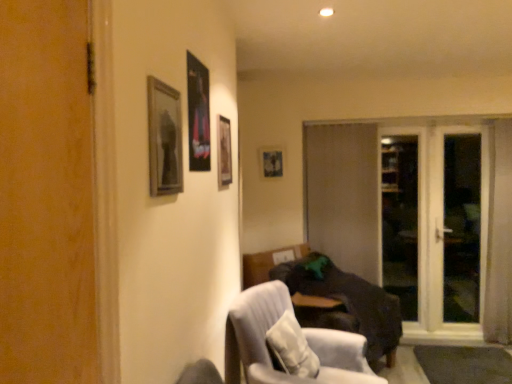
Question: From the image's perspective, is brown matte door at center located above dark brown fabric couch at lower right?

Choices:
 (A) no
 (B) yes

Answer: (B)

Question: Is brown matte door at center far away from dark brown fabric couch at lower right?

Choices:
 (A) yes
 (B) no

Answer: (B)

Question: Is brown matte door at center at the left side of dark brown fabric couch at lower right?

Choices:
 (A) no
 (B) yes

Answer: (A)

Question: Is brown matte door at center to the right of dark brown fabric couch at lower right from the viewer's perspective?

Choices:
 (A) yes
 (B) no

Answer: (A)

Question: Does brown matte door at center touch dark brown fabric couch at lower right?

Choices:
 (A) yes
 (B) no

Answer: (B)

Question: Is transparent glass screen door at right, which ranks as the 2th screen door in right-to-left order, taller or shorter than light gray fabric chair at lower center?

Choices:
 (A) short
 (B) tall

Answer: (B)

Question: From a real-world perspective, is transparent glass screen door at right, the 1th screen door when ordered from left to right, positioned above or below light gray fabric chair at lower center?

Choices:
 (A) below
 (B) above

Answer: (B)

Question: From the image's perspective, is transparent glass screen door at right, which ranks as the 2th screen door in right-to-left order, located above or below light gray fabric chair at lower center?

Choices:
 (A) above
 (B) below

Answer: (A)

Question: Considering the positions of point (459, 220) and point (316, 347), is point (459, 220) closer or farther from the camera than point (316, 347)?

Choices:
 (A) farther
 (B) closer

Answer: (A)

Question: In terms of height, does transparent glass screen door at right, which ranks as the 2th screen door in right-to-left order, look taller or shorter compared to white textured pillow at lower center?

Choices:
 (A) tall
 (B) short

Answer: (A)

Question: Would you say transparent glass screen door at right, the 1th screen door when ordered from left to right, is to the left or to the right of white textured pillow at lower center in the picture?

Choices:
 (A) left
 (B) right

Answer: (B)

Question: From the image's perspective, is transparent glass screen door at right, the 1th screen door when ordered from left to right, above or below white textured pillow at lower center?

Choices:
 (A) above
 (B) below

Answer: (A)

Question: Considering the positions of transparent glass screen door at right, the 1th screen door when ordered from left to right, and white textured pillow at lower center in the image, is transparent glass screen door at right, the 1th screen door when ordered from left to right, wider or thinner than white textured pillow at lower center?

Choices:
 (A) thin
 (B) wide

Answer: (A)

Question: From a real-world perspective, is wooden picture frame at center, which is the fourth picture frame from left to right, above or below transparent glass screen door at right, which is the first screen door in right-to-left order?

Choices:
 (A) below
 (B) above

Answer: (B)

Question: Is wooden picture frame at center, arranged as the first picture frame when viewed from the right, situated inside transparent glass screen door at right, which is the first screen door in right-to-left order, or outside?

Choices:
 (A) inside
 (B) outside

Answer: (B)